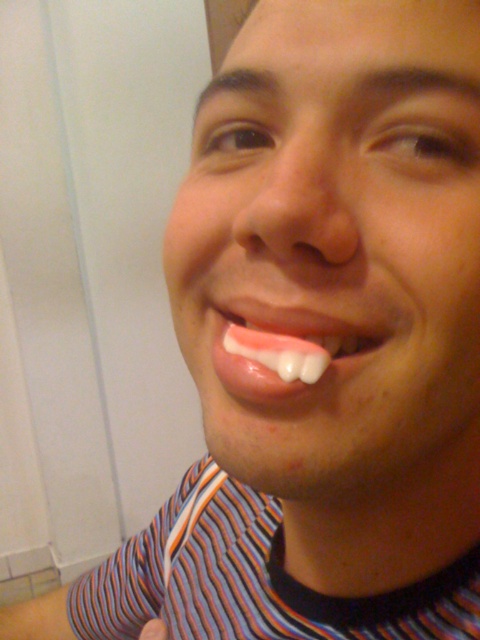
Question: Is striped fabric shirt at lower center above pink glossy tongue at center?

Choices:
 (A) yes
 (B) no

Answer: (B)

Question: Can you confirm if striped fabric shirt at lower center is smaller than pink glossy tongue at center?

Choices:
 (A) yes
 (B) no

Answer: (B)

Question: Does striped fabric shirt at lower center have a greater width compared to pink glossy tongue at center?

Choices:
 (A) yes
 (B) no

Answer: (A)

Question: Which point is closer to the camera taking this photo?

Choices:
 (A) (301, 376)
 (B) (452, 582)

Answer: (A)

Question: Which of the following is the farthest from the observer?

Choices:
 (A) striped fabric shirt at lower center
 (B) pink glossy tongue at center

Answer: (A)

Question: Which object appears closest to the camera in this image?

Choices:
 (A) striped fabric shirt at lower center
 (B) pink glossy tongue at center

Answer: (B)